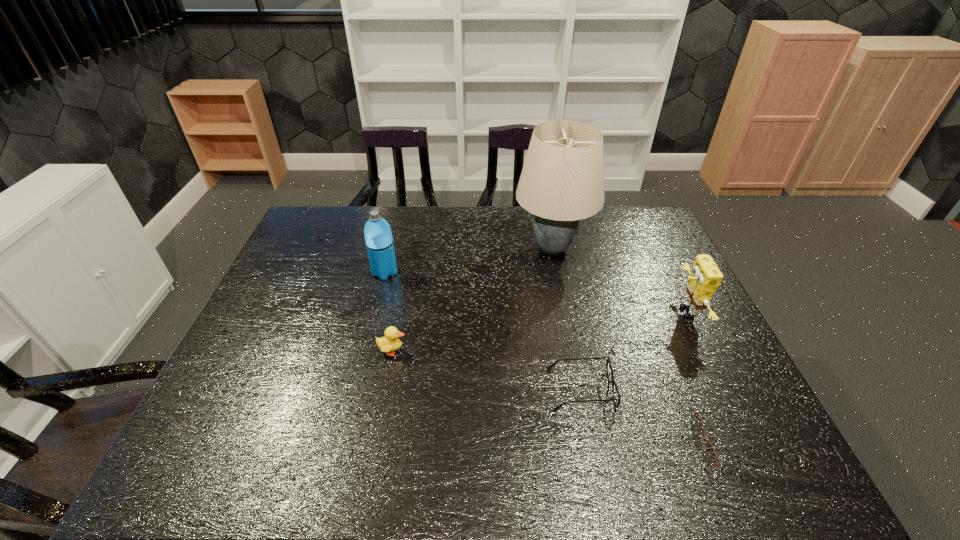
In the image, there is a desktop. Where is `vacant space at the far left corner`? The image size is (960, 540). vacant space at the far left corner is located at coordinates (305, 228).

This screenshot has height=540, width=960. What are the coordinates of `vacant region at the near left corner` in the screenshot? It's located at (193, 454).

Where is `free space between the second tallest object and the shortest object`? The height and width of the screenshot is (540, 960). free space between the second tallest object and the shortest object is located at coordinates (553, 357).

I want to click on unoccupied area between the second shortest object and the tallest object, so click(x=566, y=319).

Identify the location of free point between the sunglasses and the second nearest object. (651, 416).

Locate an element on the screen. This screenshot has height=540, width=960. free spot between the shortest object and the duckling is located at coordinates (557, 396).

Identify the location of vacant space that's between the thermos bottle and the second shortest object. (483, 331).

Locate an element on the screen. unoccupied position between the fifth shortest object and the sunglasses is located at coordinates click(x=553, y=357).

This screenshot has width=960, height=540. Identify the location of blank region between the third tallest object and the tallest object. (619, 280).

The width and height of the screenshot is (960, 540). In order to click on free space between the thermos bottle and the tallest object in this screenshot , I will do `click(468, 260)`.